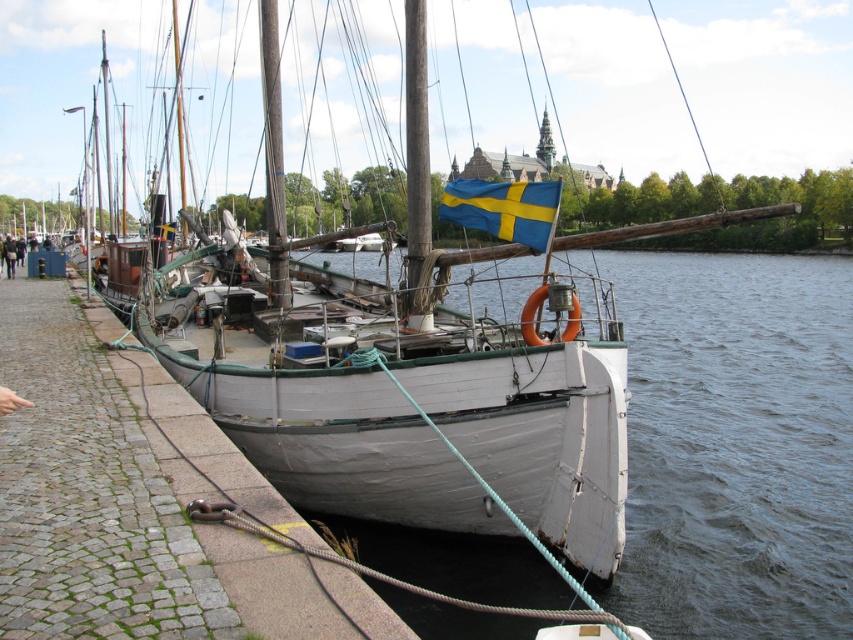
You are standing on the gray stone dock at lower left and want to step onto the white matte water at lower center. Is the water directly to your right side?

Yes, the white matte water at lower center is to the right of gray stone dock at lower left, so stepping to your right would lead you towards the water.

You are standing on the pier and want to step onto the gray stone dock at lower left. Which direction should you move relative to the white matte water at lower center?

Since the white matte water at lower center is further away from you than the gray stone dock at lower left, you should move towards the gray stone dock at lower left, which is closer to your current position on the pier.